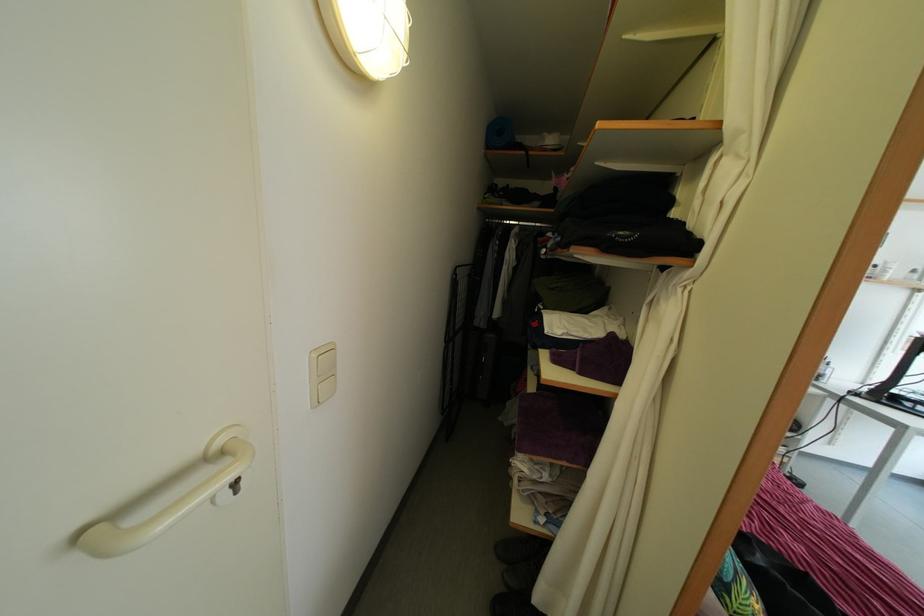
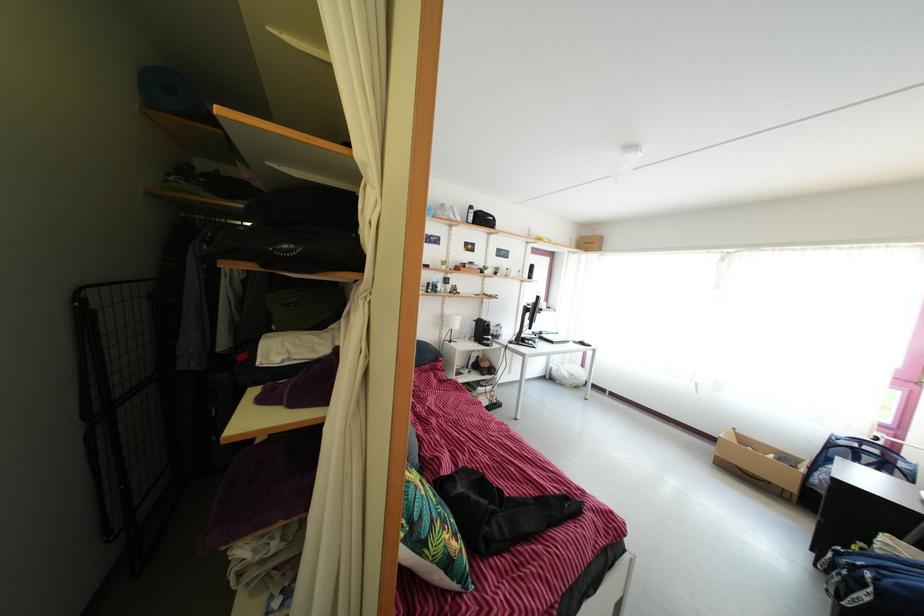
The point at (460,282) is marked in the first image. Where is the corresponding point in the second image?

(86, 307)